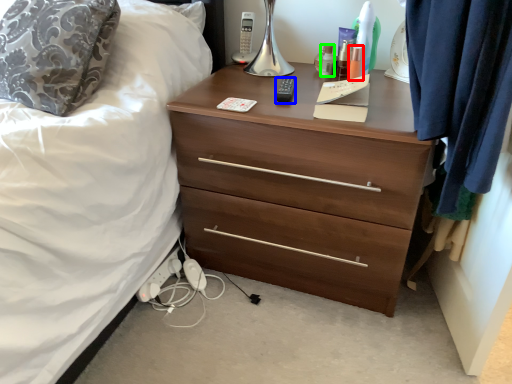
Question: Which object is the closest to the toiletry (highlighted by a red box)? Choose among these: remote control (highlighted by a blue box) or toiletry (highlighted by a green box).

Choices:
 (A) remote control
 (B) toiletry

Answer: (B)